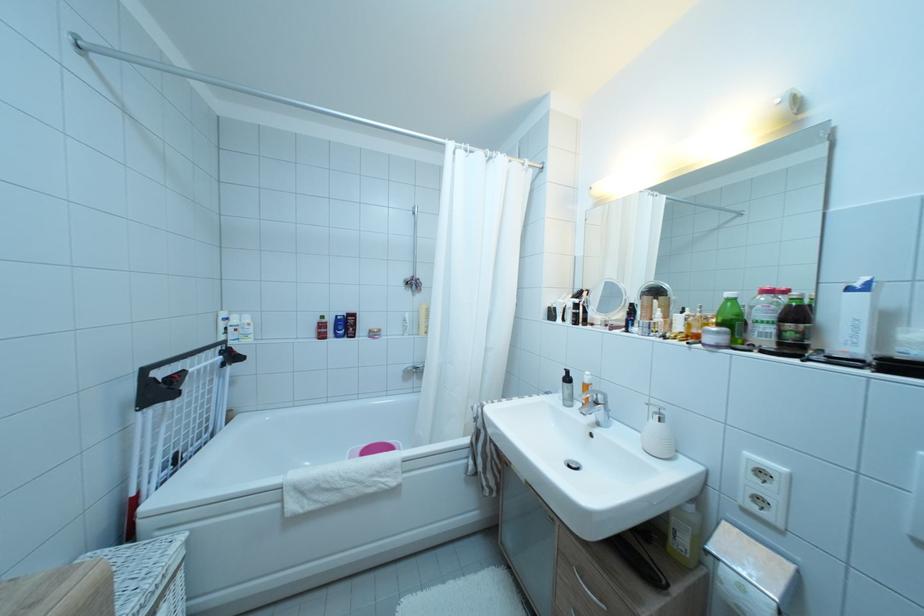
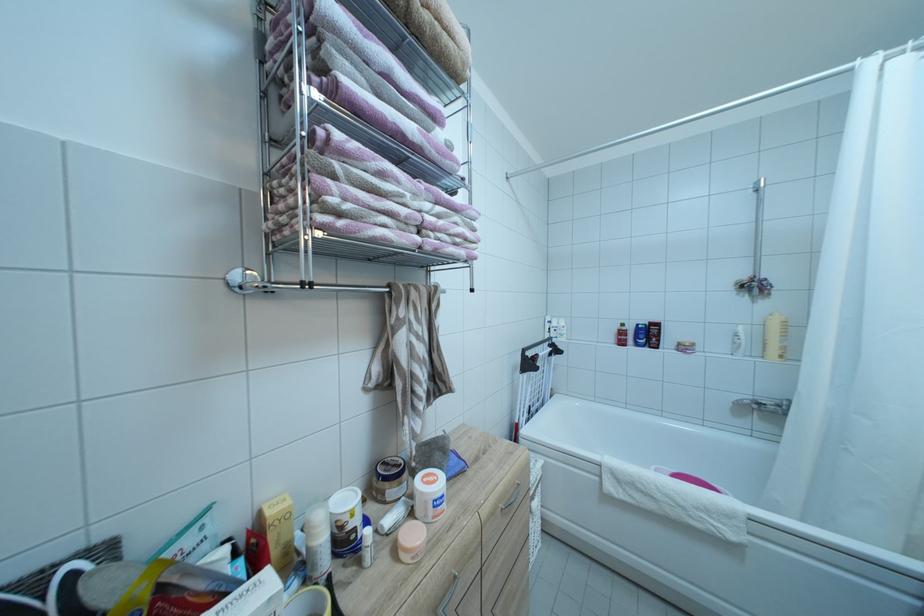
Question: The images are taken continuously from a first-person perspective. In which direction is your viewpoint rotating?

Choices:
 (A) Left
 (B) Right
 (C) Up
 (D) Down

Answer: (A)